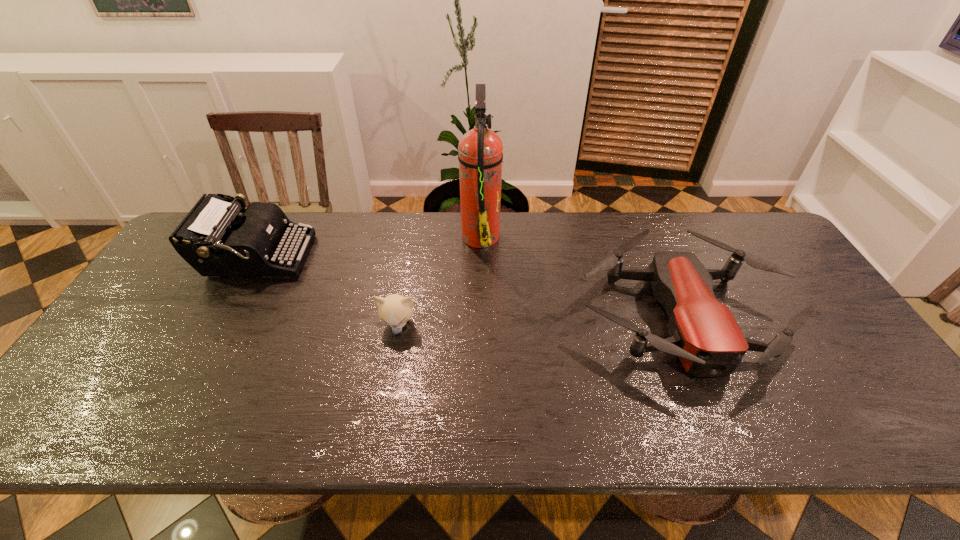
Locate an element on the screen. fire extinguisher is located at coordinates (480, 155).

At what (x,y) coordinates should I click in order to perform the action: click on the second object from right to left. Please return your answer as a coordinate pair (x, y). The height and width of the screenshot is (540, 960). Looking at the image, I should click on (480, 155).

Identify the location of the leftmost object. The width and height of the screenshot is (960, 540). (213, 238).

At what (x,y) coordinates should I click in order to perform the action: click on typewriter. Please return your answer as a coordinate pair (x, y). The width and height of the screenshot is (960, 540). Looking at the image, I should click on (213, 238).

The image size is (960, 540). I want to click on the rightmost object, so click(x=704, y=334).

Locate an element on the screen. The width and height of the screenshot is (960, 540). kitten is located at coordinates (395, 310).

You are a GUI agent. You are given a task and a screenshot of the screen. Output one action in this format:
    pyautogui.click(x=<x>, y=<y>)
    Task: Click on the vacant space located 0.130m at the nozzle of the third object from left to right
    
    Given the screenshot: What is the action you would take?
    pyautogui.click(x=421, y=235)

Where is `free space located 0.360m at the nozzle of the third object from left to right`? free space located 0.360m at the nozzle of the third object from left to right is located at coordinates (350, 235).

You are a GUI agent. You are given a task and a screenshot of the screen. Output one action in this format:
    pyautogui.click(x=<x>, y=<y>)
    Task: Click on the free location located 0.050m at the nozzle of the third object from left to right
    
    Given the screenshot: What is the action you would take?
    pyautogui.click(x=445, y=235)

This screenshot has width=960, height=540. What are the coordinates of `vacant region located 0.160m on the typing side of the leftmost object` in the screenshot? It's located at (360, 258).